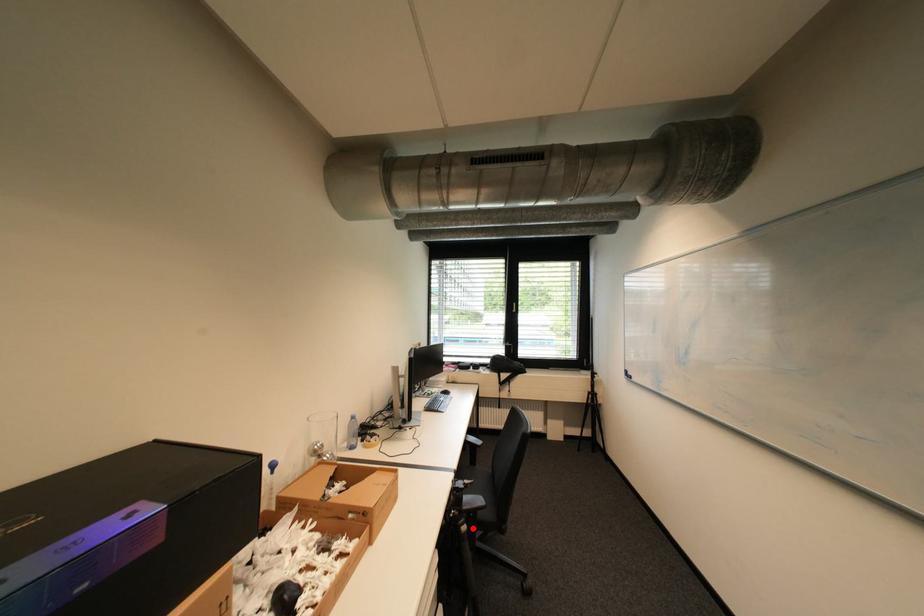
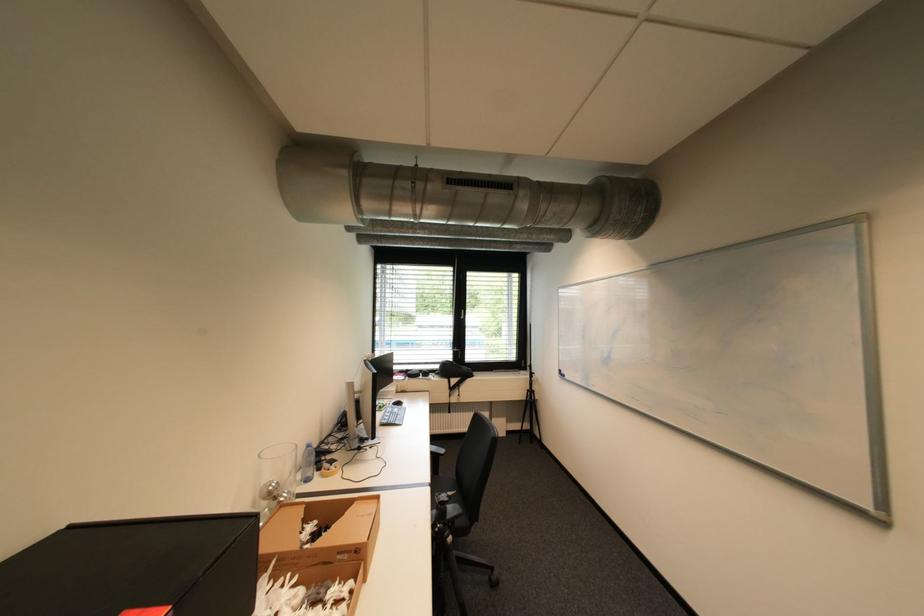
Question: A red point is marked in image1. In image2, is the corresponding 3D point closer to the camera or farther? Reply with the corresponding letter.

Choices:
 (A) The corresponding 3D point is closer.
 (B) The corresponding 3D point is farther.

Answer: (A)